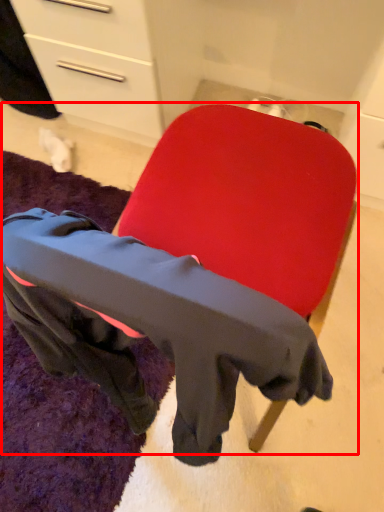
Question: Considering the relative positions of chair (annotated by the red box) and mat in the image provided, where is chair (annotated by the red box) located with respect to the staircase?

Choices:
 (A) left
 (B) right

Answer: (B)